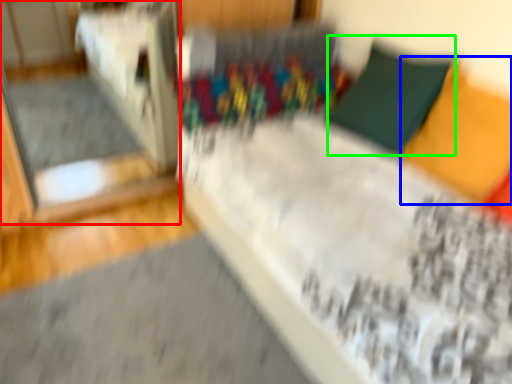
Question: Which object is positioned farthest from glass door (highlighted by a red box)? Select from pillow (highlighted by a blue box) and pillow (highlighted by a green box).

Choices:
 (A) pillow
 (B) pillow

Answer: (A)